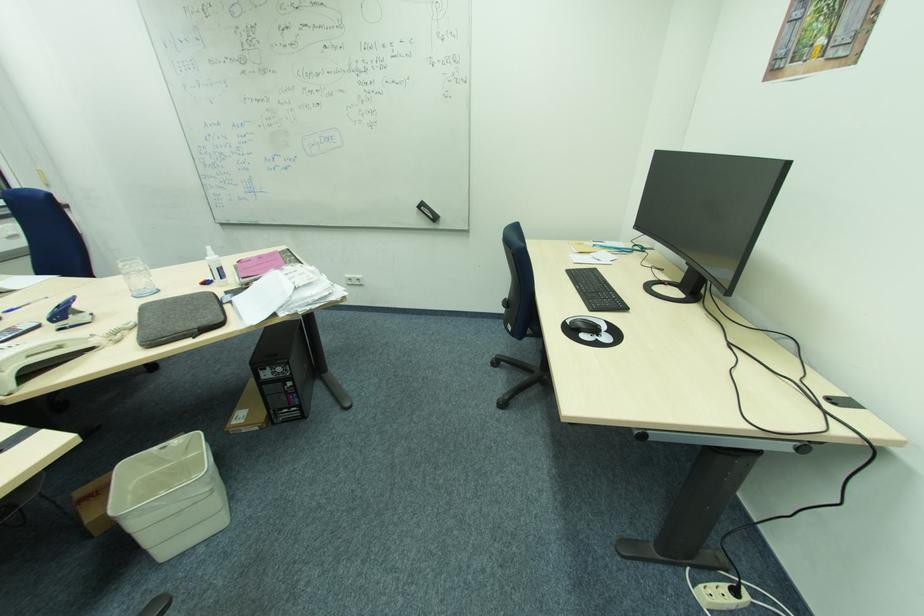
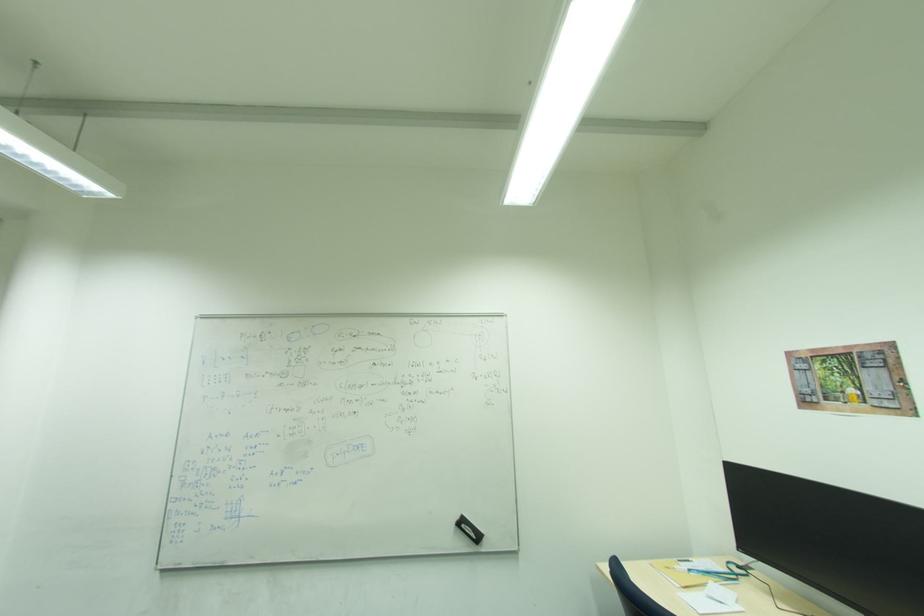
Question: The images are taken continuously from a first-person perspective. In which direction is your viewpoint rotating?

Choices:
 (A) Left
 (B) Right
 (C) Up
 (D) Down

Answer: (C)